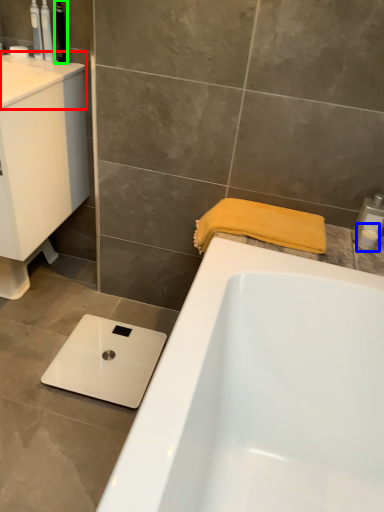
Question: Which object is positioned farthest from counter top (highlighted by a red box)? Select from toiletry (highlighted by a blue box) and toiletry (highlighted by a green box).

Choices:
 (A) toiletry
 (B) toiletry

Answer: (A)